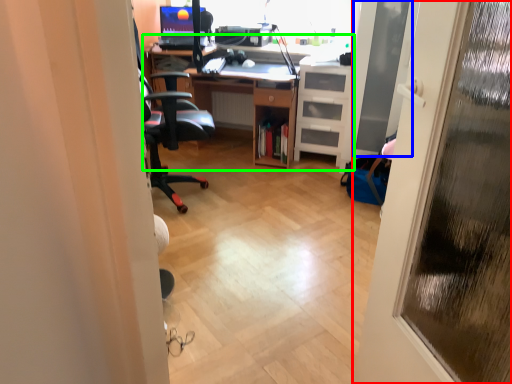
Question: Based on their relative distances, which object is nearer to door (highlighted by a red box)? Choose from screen door (highlighted by a blue box) and computer desk (highlighted by a green box).

Choices:
 (A) screen door
 (B) computer desk

Answer: (A)